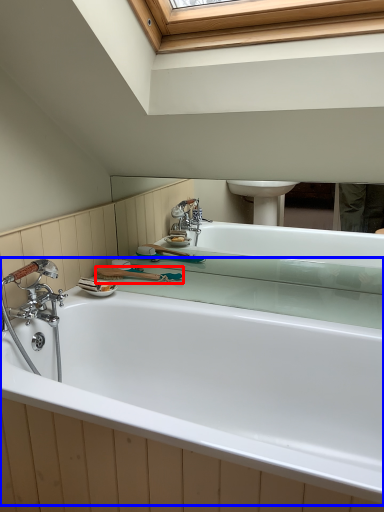
Question: Which point is further to the camera, shower (highlighted by a red box) or bathtub (highlighted by a blue box)?

Choices:
 (A) shower
 (B) bathtub

Answer: (A)